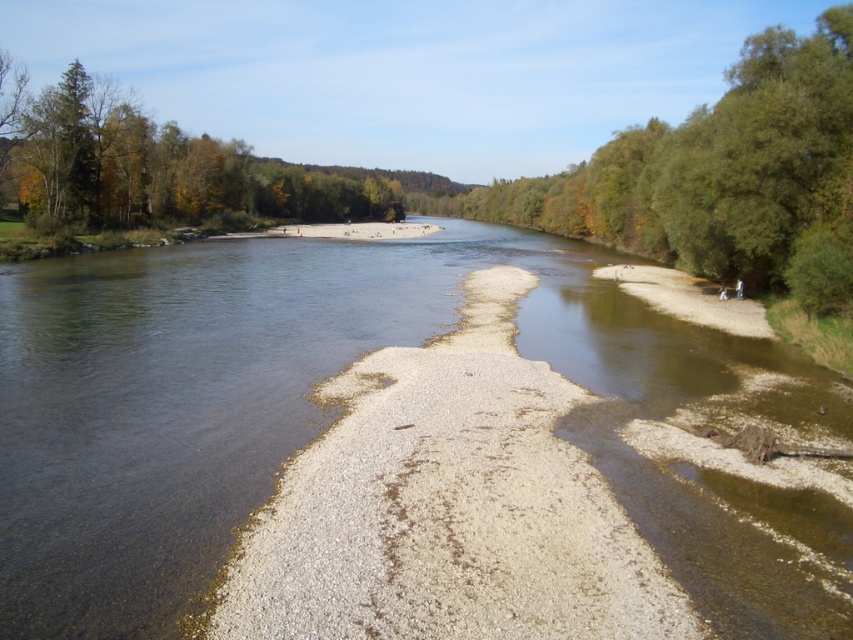
Question: Does clear water at center appear on the left side of green leafy tree at right?

Choices:
 (A) no
 (B) yes

Answer: (B)

Question: Which of the following is the closest to the observer?

Choices:
 (A) green leafy tree at right
 (B) clear water at center

Answer: (B)

Question: Does clear water at center lie in front of green leafy tree at right?

Choices:
 (A) no
 (B) yes

Answer: (B)

Question: Which point is farther to the camera?

Choices:
 (A) (202, 186)
 (B) (817, 259)
 (C) (225, 300)

Answer: (A)

Question: Is clear water at center bigger than green leafy tree at right?

Choices:
 (A) no
 (B) yes

Answer: (A)

Question: Which point is farther from the camera taking this photo?

Choices:
 (A) (129, 202)
 (B) (656, 209)

Answer: (A)